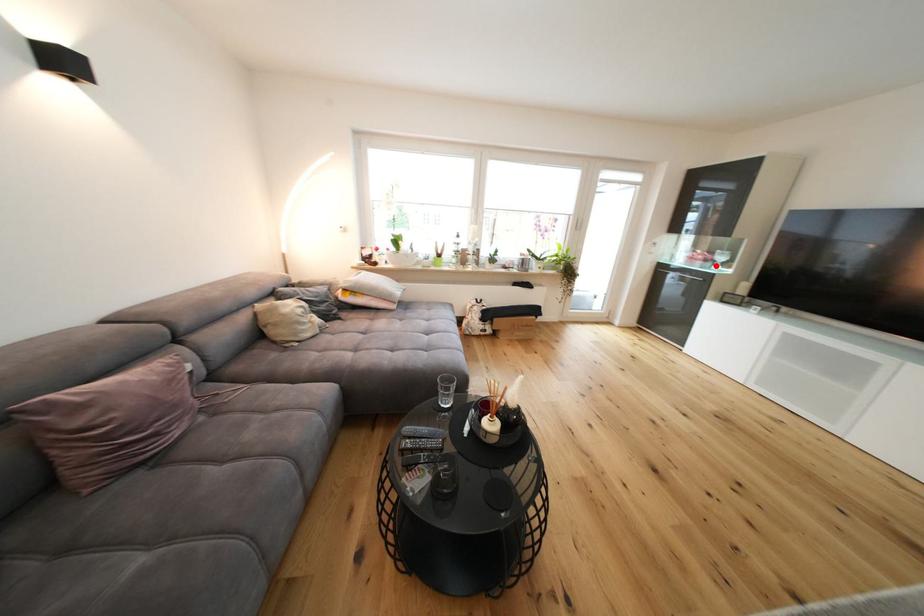
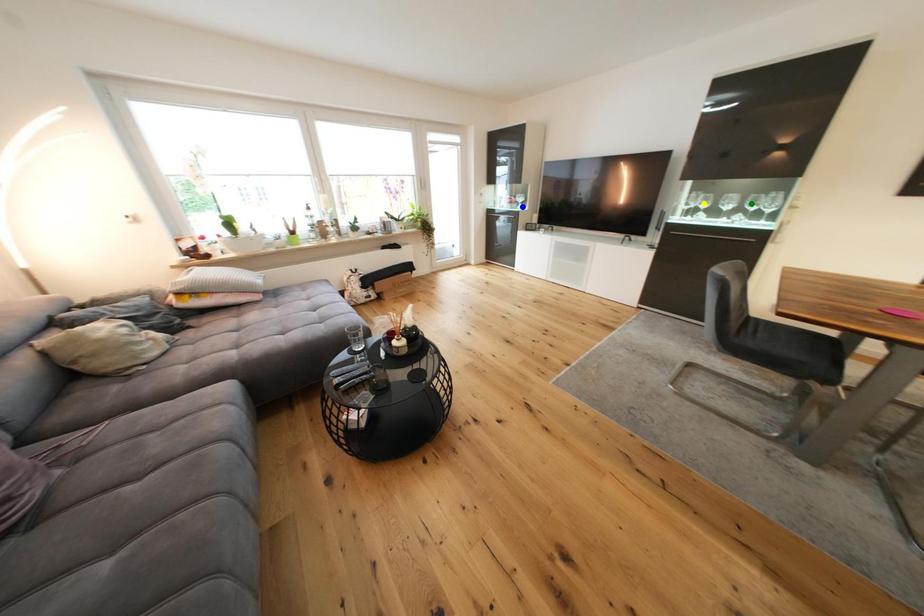
Question: I am providing you with two images of the same scene from different viewpoints. A red point is marked on the first image. You are given multiple points on the second image. Can you choose the point in image 2 that corresponds to the point in image 1?

Choices:
 (A) green point
 (B) blue point
 (C) yellow point

Answer: (B)